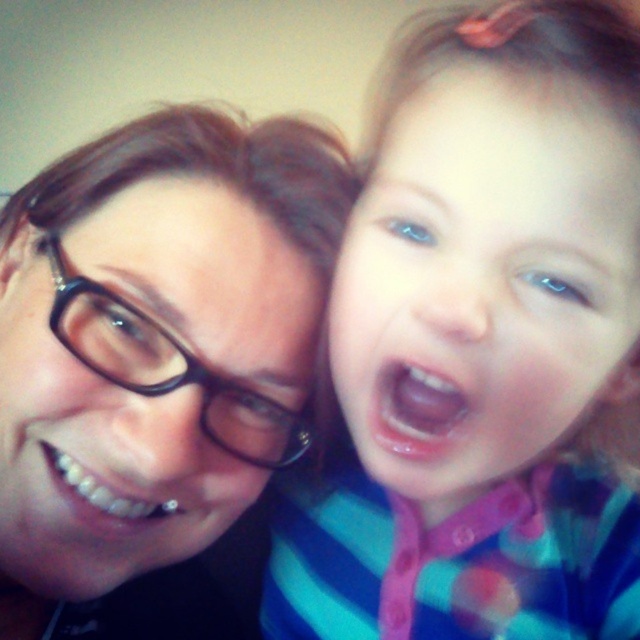
Is blue eyes at center bigger than matte black glasses at left?

Yes.

Does blue eyes at center have a lesser width compared to matte black glasses at left?

Correct, blue eyes at center's width is less than matte black glasses at left's.

What are the coordinates of `blue eyes at center` in the screenshot? It's located at (484, 282).

Where is `blue eyes at center`? blue eyes at center is located at coordinates (484, 282).